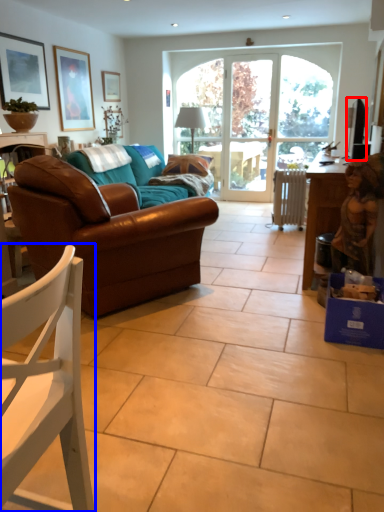
Question: Among these objects, which one is nearest to the camera, television (highlighted by a red box) or chair (highlighted by a blue box)?

Choices:
 (A) television
 (B) chair

Answer: (B)